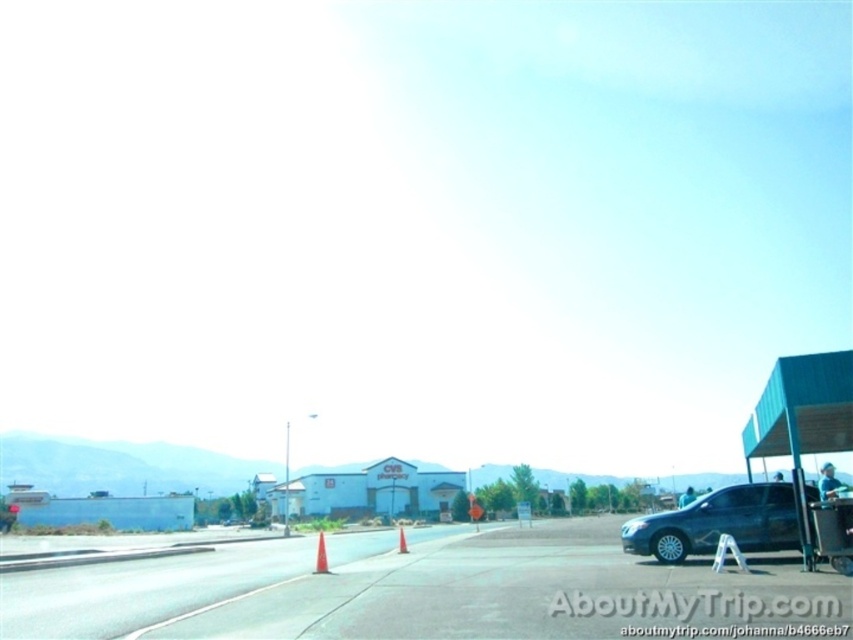
You are a delivery driver who needs to park your vehicle on the asphalt road at center. However, there is a no parking zone marked at point 0.922, 0.470. Can you park there?

The position of asphalt road at center is at point (x=399, y=589), which is the location of the no parking zone. Therefore, you cannot park there.

You are a delivery driver who needs to park your truck between the orange matte traffic cone at center and the orange plastic traffic cone at center. The truck requires a minimum of 1.2 meters of space to maneuver. Can you determine if there is enough space between them?

The orange matte traffic cone at center has a lesser height compared to orange plastic traffic cone at center, but the distance between them is not specified in the objects description. Therefore, it is impossible to determine if there is enough space for the truck to maneuver between them.